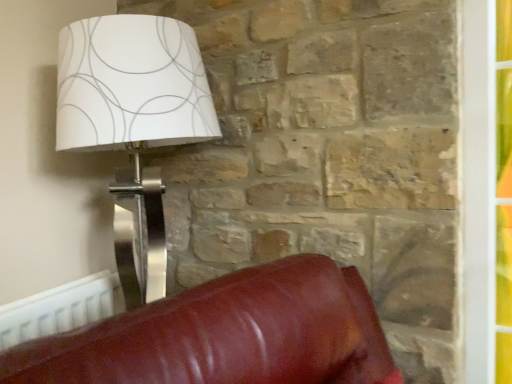
Question: Does white paper lampshade at upper left appear on the left side of white plastic radiator at lower left?

Choices:
 (A) yes
 (B) no

Answer: (B)

Question: Does white paper lampshade at upper left have a greater width compared to white plastic radiator at lower left?

Choices:
 (A) no
 (B) yes

Answer: (B)

Question: Is white paper lampshade at upper left turned away from white plastic radiator at lower left?

Choices:
 (A) yes
 (B) no

Answer: (A)

Question: Is white paper lampshade at upper left not close to white plastic radiator at lower left?

Choices:
 (A) yes
 (B) no

Answer: (B)

Question: Can you confirm if white paper lampshade at upper left is shorter than white plastic radiator at lower left?

Choices:
 (A) no
 (B) yes

Answer: (A)

Question: Considering the relative sizes of white paper lampshade at upper left and white plastic radiator at lower left in the image provided, is white paper lampshade at upper left bigger than white plastic radiator at lower left?

Choices:
 (A) no
 (B) yes

Answer: (B)

Question: From a real-world perspective, is white plastic radiator at lower left below white paper lampshade at upper left?

Choices:
 (A) yes
 (B) no

Answer: (A)

Question: Does white plastic radiator at lower left come in front of white paper lampshade at upper left?

Choices:
 (A) no
 (B) yes

Answer: (A)

Question: Does white plastic radiator at lower left have a lesser width compared to white paper lampshade at upper left?

Choices:
 (A) yes
 (B) no

Answer: (A)

Question: Considering the relative sizes of white plastic radiator at lower left and white paper lampshade at upper left in the image provided, is white plastic radiator at lower left taller than white paper lampshade at upper left?

Choices:
 (A) yes
 (B) no

Answer: (B)

Question: Can you see white plastic radiator at lower left touching white paper lampshade at upper left?

Choices:
 (A) no
 (B) yes

Answer: (A)

Question: From the image's perspective, would you say white plastic radiator at lower left is shown under white paper lampshade at upper left?

Choices:
 (A) yes
 (B) no

Answer: (A)

Question: Considering the positions of point (157, 233) and point (54, 314), is point (157, 233) closer or farther from the camera than point (54, 314)?

Choices:
 (A) farther
 (B) closer

Answer: (A)